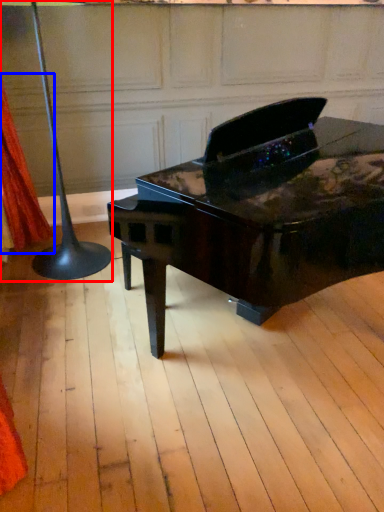
Question: Which object is closer to the camera taking this photo, table lamp (highlighted by a red box) or curtain (highlighted by a blue box)?

Choices:
 (A) table lamp
 (B) curtain

Answer: (A)